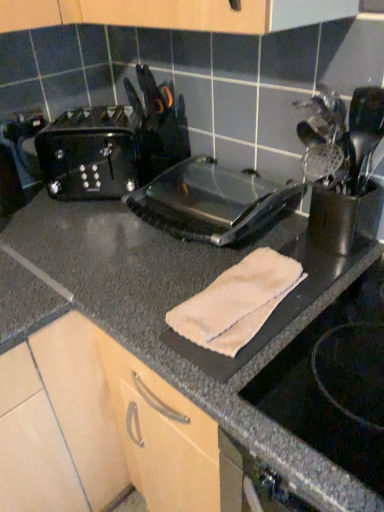
I want to click on free location in front of satin silver utensil holder at right, so click(355, 290).